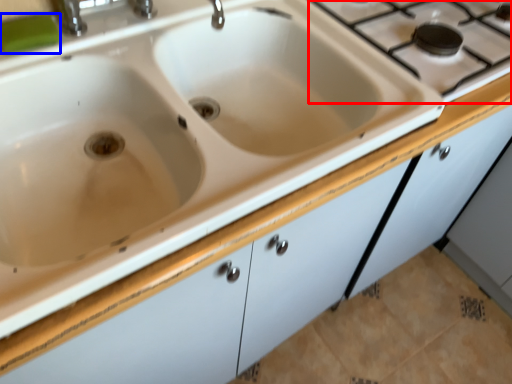
Question: Which object appears closest to the camera in this image, gas stove (highlighted by a red box) or soap (highlighted by a blue box)?

Choices:
 (A) gas stove
 (B) soap

Answer: (B)